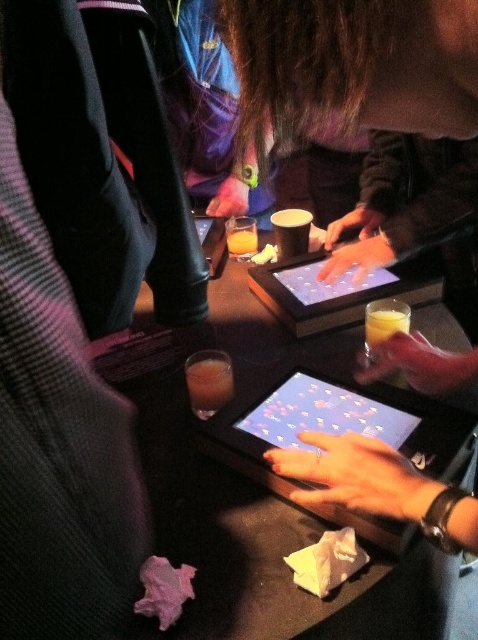
Question: Which point appears closest to the camera in this image?

Choices:
 (A) (144, 378)
 (B) (231, 236)

Answer: (A)

Question: Which object appears farthest from the camera in this image?

Choices:
 (A) translucent glass at center
 (B) matte black tablet at center
 (C) translucent plastic cup at center

Answer: (A)

Question: Where is translucent plastic cup at center located in relation to translucent glass at center in the image?

Choices:
 (A) above
 (B) below

Answer: (B)

Question: Can you confirm if matte black tablet at center is bigger than translucent glass cup at center?

Choices:
 (A) no
 (B) yes

Answer: (B)

Question: Among these points, which one is nearest to the camera?

Choices:
 (A) 379,307
 (B) 213,401
 (C) 254,246

Answer: (B)

Question: Is shiny black tablet at center closer to the viewer compared to translucent glass cup at center?

Choices:
 (A) no
 (B) yes

Answer: (B)